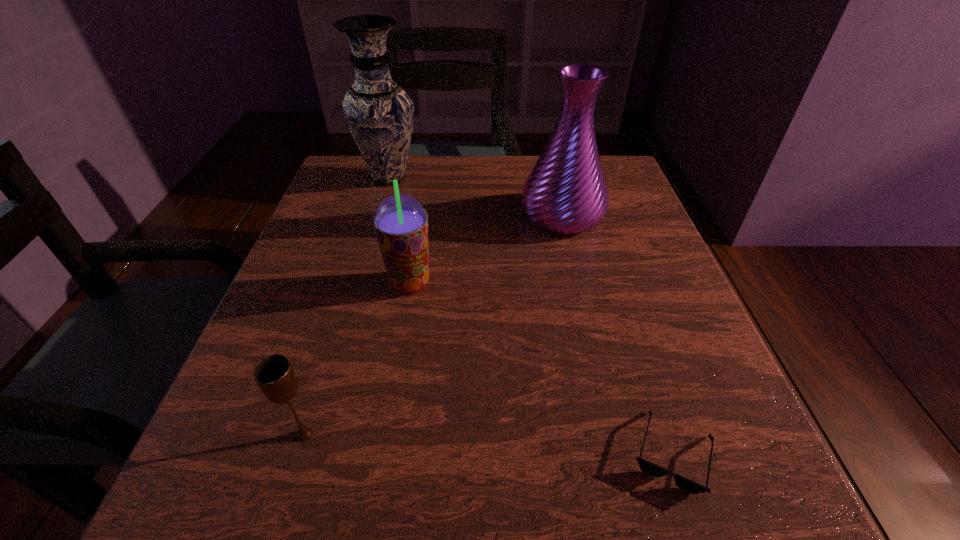
At what (x,y) coordinates should I click in order to perform the action: click on object positioned at the near edge. Please return your answer as a coordinate pair (x, y). Looking at the image, I should click on (647, 467).

Identify the location of vase that is at the left edge. The width and height of the screenshot is (960, 540). (379, 113).

Find the location of `chalice at the left edge`. chalice at the left edge is located at coordinates (274, 375).

Locate an element on the screen. The image size is (960, 540). vase that is at the right edge is located at coordinates (566, 192).

The height and width of the screenshot is (540, 960). I want to click on sunglasses at the right edge, so click(647, 467).

Find the location of a particular element. object at the far left corner is located at coordinates (379, 113).

You are a GUI agent. You are given a task and a screenshot of the screen. Output one action in this format:
    pyautogui.click(x=<x>, y=<y>)
    Task: Click on the object located at the far right corner
    
    Given the screenshot: What is the action you would take?
    566,192

Locate an element on the screen. This screenshot has width=960, height=540. object that is at the near right corner is located at coordinates (647, 467).

Identify the location of vacant region at the far edge of the desktop. (449, 163).

In the image, there is a desktop. Where is `vacant space at the near edge`? Image resolution: width=960 pixels, height=540 pixels. vacant space at the near edge is located at coordinates (461, 477).